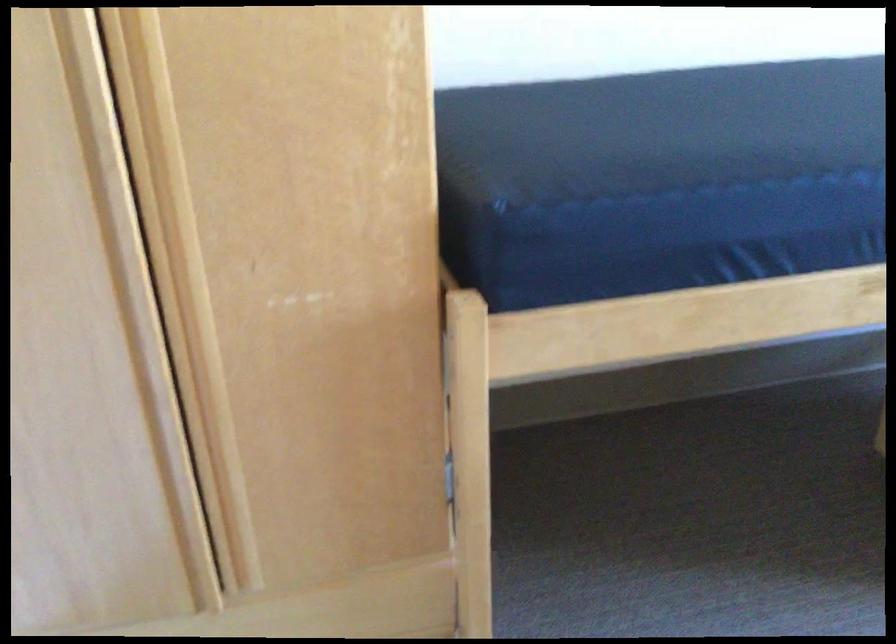
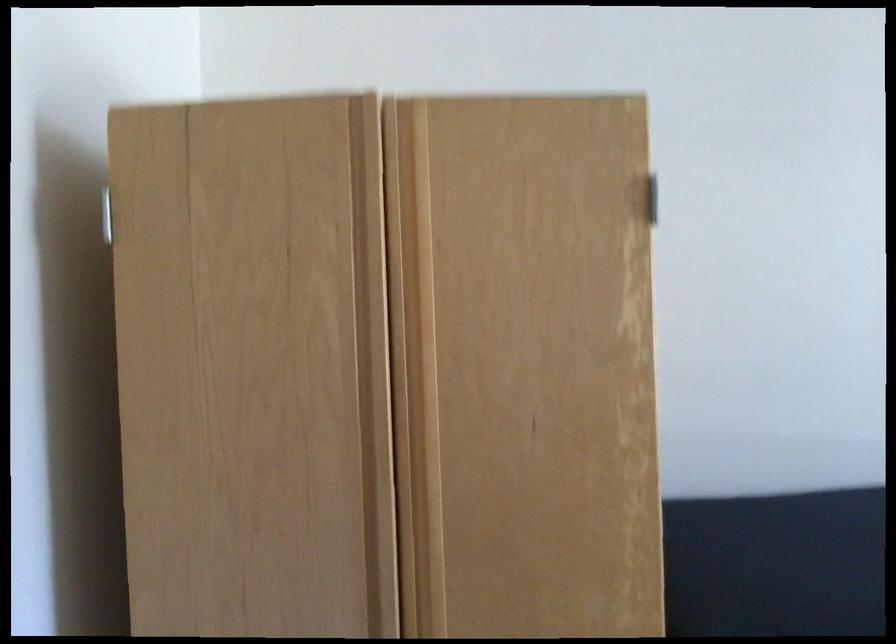
Looking at this image, which direction would the cameraman need to move to produce the second image?

The cameraman walked toward left, backward.